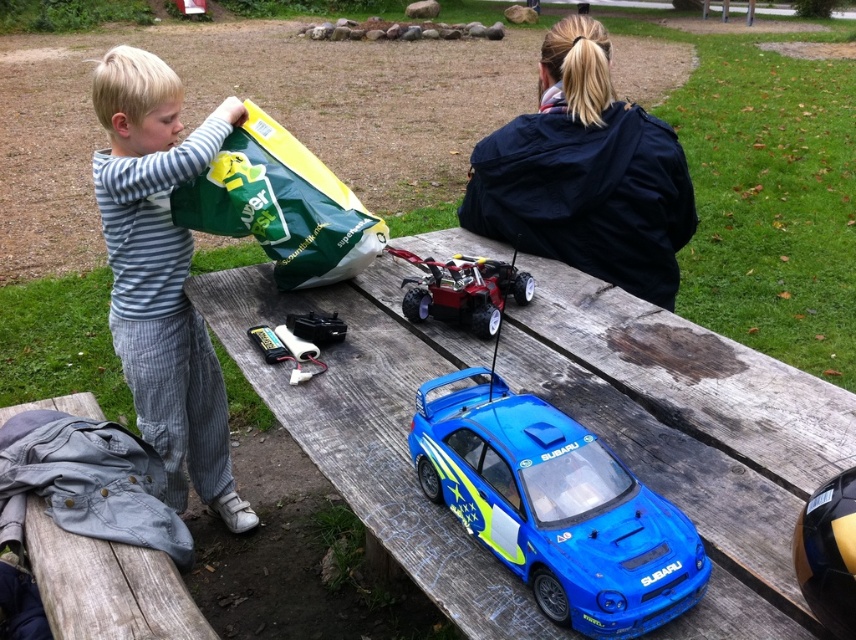
Question: Can you confirm if striped cotton shirt at left is wider than green matte bag at upper left?

Choices:
 (A) yes
 (B) no

Answer: (B)

Question: Which object is the closest to the striped cotton shirt at left?

Choices:
 (A) blue glossy toy car at center
 (B) green matte bag at upper left
 (C) metallic red toy car at center
 (D) blue plastic car at center

Answer: (B)

Question: Can you confirm if blue plastic car at center is bigger than striped cotton shirt at left?

Choices:
 (A) no
 (B) yes

Answer: (B)

Question: From the image, what is the correct spatial relationship of blue glossy toy car at center in relation to metallic red toy car at center?

Choices:
 (A) left
 (B) right

Answer: (B)

Question: Which is farther from the metallic red toy car at center?

Choices:
 (A) striped cotton shirt at left
 (B) blue plastic car at center

Answer: (A)

Question: Which object appears closest to the camera in this image?

Choices:
 (A) blue glossy toy car at center
 (B) striped cotton shirt at left
 (C) blue plastic car at center
 (D) metallic red toy car at center

Answer: (A)